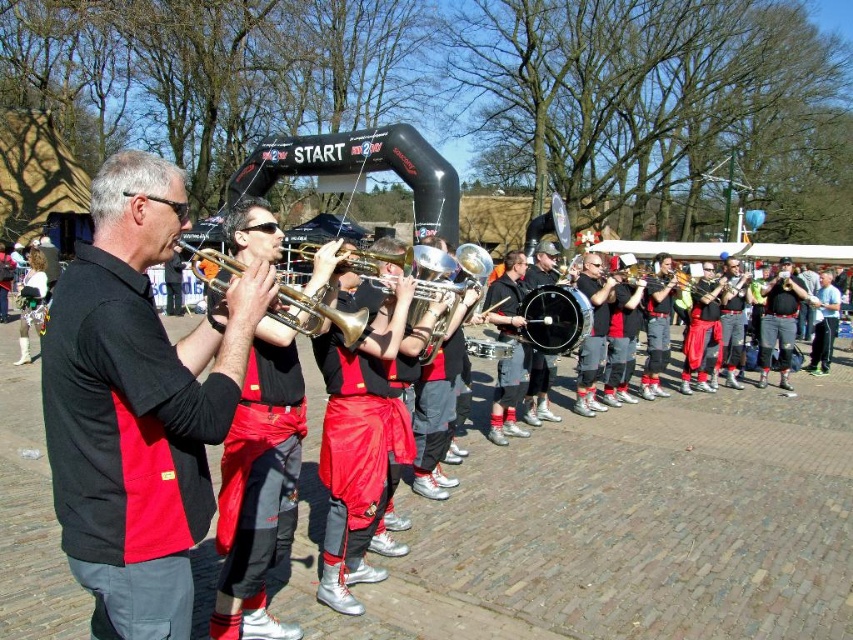
Question: Does matte black shirt at left have a smaller size compared to matte black trumpet at left?

Choices:
 (A) no
 (B) yes

Answer: (A)

Question: Estimate the real-world distances between objects in this image. Which object is closer to the matte black trumpet at left?

Choices:
 (A) gold brass trumpet at center
 (B) matte black shirt at left

Answer: (A)

Question: Which point is closer to the camera?

Choices:
 (A) (277, 563)
 (B) (308, 324)
 (C) (100, 333)

Answer: (C)

Question: Where is matte black shirt at left located in relation to gold brass trumpet at center in the image?

Choices:
 (A) left
 (B) right

Answer: (A)

Question: Where is matte black trumpet at left located in relation to gold brass trumpet at center in the image?

Choices:
 (A) below
 (B) above

Answer: (A)

Question: Considering the real-world distances, which object is closest to the matte black trumpet at left?

Choices:
 (A) gold brass trumpet at center
 (B) matte black shirt at left

Answer: (A)